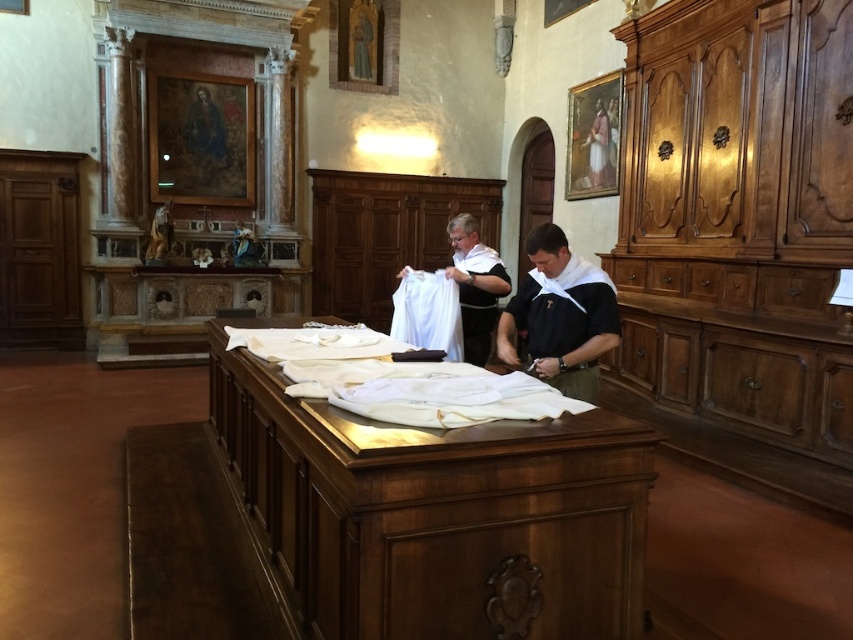
You are standing in the room and want to place a small candle on the wooden table at center. Given that the room has a coordinate system where the bottom left corner is the origin, can you confirm if the point at coordinates (437, 513) corresponds to the wooden table at center?

Yes, the point at coordinates (437, 513) corresponds to the wooden table at center as indicated in the Objects Description.

You are standing in the room described and need to locate the black cotton shirt at center. According to the coordinates given, where exactly would you find it?

The black cotton shirt at center is located at the 2D coordinates point (560,316).

You are standing in the room and want to place a small statue on the wooden table at center. Based on the coordinates provided, can you confirm that the point marked at (437,513) is indeed the location of the wooden table at center?

Yes, the point marked at (437,513) is indeed the location of the wooden table at center as per the description provided.